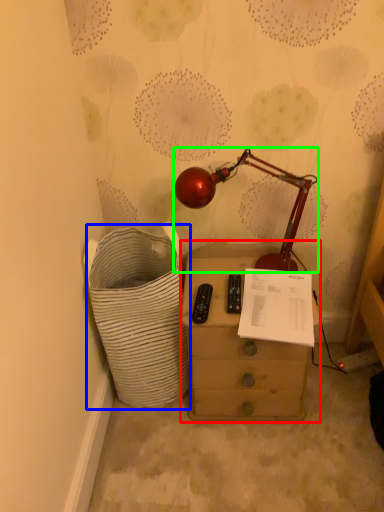
Question: Considering the real-world distances, which object is closest to chest of drawers (highlighted by a red box)? laundry basket (highlighted by a blue box) or lamp (highlighted by a green box).

Choices:
 (A) laundry basket
 (B) lamp

Answer: (A)